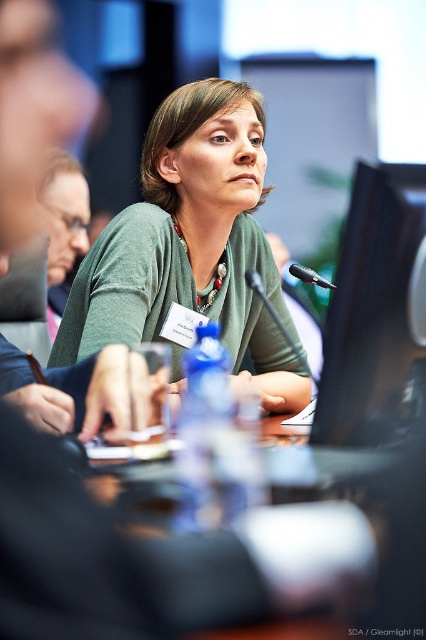
The height and width of the screenshot is (640, 426). What do you see at coordinates (394, 536) in the screenshot?
I see `transparent glass table at center` at bounding box center [394, 536].

Can you confirm if transparent glass table at center is positioned to the right of black plastic microphone at center?

No, transparent glass table at center is not to the right of black plastic microphone at center.

Is point (402, 502) less distant than point (290, 268)?

That is True.

Where is `transparent glass table at center`? transparent glass table at center is located at coordinates (394, 536).

Does black glossy monitor at center lie behind black plastic microphone at center?

That is False.

Can you confirm if black glossy monitor at center is positioned to the left of black plastic microphone at center?

Correct, you'll find black glossy monitor at center to the left of black plastic microphone at center.

Between point (379, 168) and point (305, 273), which one is positioned behind?

The point (305, 273) is more distant.

The height and width of the screenshot is (640, 426). What are the coordinates of `black glossy monitor at center` in the screenshot? It's located at (374, 308).

Who is more forward, (146,276) or (299,266)?

Point (146,276) is in front.

Can you confirm if green matte cardigan at center is positioned to the right of black plastic microphone at center?

No, green matte cardigan at center is not to the right of black plastic microphone at center.

In order to click on green matte cardigan at center in this screenshot , I will do `click(192, 244)`.

Where is `green matte cardigan at center`? green matte cardigan at center is located at coordinates (192, 244).